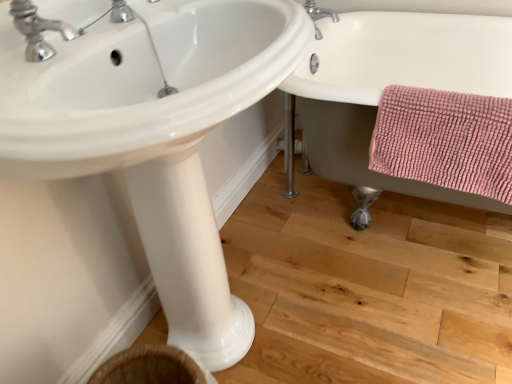
What do you see at coordinates (445, 140) in the screenshot? I see `pink chenille bath towel at lower right` at bounding box center [445, 140].

Find the location of a particular element. The width and height of the screenshot is (512, 384). pink chenille bath towel at lower right is located at coordinates (445, 140).

Image resolution: width=512 pixels, height=384 pixels. Describe the element at coordinates (154, 135) in the screenshot. I see `white glossy sink at center` at that location.

This screenshot has width=512, height=384. What do you see at coordinates (38, 30) in the screenshot? I see `chrome metallic faucet at upper left, the first tap positioned from the bottom` at bounding box center [38, 30].

The width and height of the screenshot is (512, 384). Describe the element at coordinates (390, 84) in the screenshot. I see `white ceramic bathtub at right` at that location.

Where is `silver metallic faucet at upper center, the 2th tap positioned from the bottom`? The height and width of the screenshot is (384, 512). silver metallic faucet at upper center, the 2th tap positioned from the bottom is located at coordinates (319, 15).

Consider the image. From a real-world perspective, is silver metallic faucet at upper center, the 1th tap from the back, positioned above or below pink chenille bath towel at lower right?

silver metallic faucet at upper center, the 1th tap from the back, is above pink chenille bath towel at lower right.

From the picture: From the image's perspective, is silver metallic faucet at upper center, which appears as the first tap when viewed from the top, above or below pink chenille bath towel at lower right?

Based on their image positions, silver metallic faucet at upper center, which appears as the first tap when viewed from the top, is located above pink chenille bath towel at lower right.

Measure the distance from silver metallic faucet at upper center, which is counted as the second tap, starting from the left, to pink chenille bath towel at lower right.

A distance of 28.15 inches exists between silver metallic faucet at upper center, which is counted as the second tap, starting from the left, and pink chenille bath towel at lower right.

Which is in front, silver metallic faucet at upper center, the 2th tap positioned from the bottom, or pink chenille bath towel at lower right?

pink chenille bath towel at lower right is closer to the camera.

Which is behind, point (378, 12) or point (82, 96)?

The point (378, 12) is behind.

Does white ceramic bathtub at right turn towards white glossy sink at center?

Yes, white ceramic bathtub at right faces towards white glossy sink at center.

Which object is more forward, white ceramic bathtub at right or white glossy sink at center?

white glossy sink at center is in front.

Is white ceramic bathtub at right smaller than white glossy sink at center?

Incorrect, white ceramic bathtub at right is not smaller in size than white glossy sink at center.

Does pink chenille bath towel at lower right come behind silver metallic faucet at upper center, which is counted as the second tap, starting from the left?

No.

From a real-world perspective, is pink chenille bath towel at lower right located beneath silver metallic faucet at upper center, which appears as the first tap when viewed from the top?

Yes, from a real-world perspective, pink chenille bath towel at lower right is beneath silver metallic faucet at upper center, which appears as the first tap when viewed from the top.

At what (x,y) coordinates should I click in order to perform the action: click on tap behind the pink chenille bath towel at lower right. Please return your answer as a coordinate pair (x, y). The image size is (512, 384). Looking at the image, I should click on (319, 15).

Between pink chenille bath towel at lower right and silver metallic faucet at upper center, which is the first tap from right to left, which one has more height?

With more height is pink chenille bath towel at lower right.

Which is in front, chrome metallic faucet at upper left, the first tap from the left, or white glossy pedestal at center?

chrome metallic faucet at upper left, the first tap from the left, is more forward.

How different are the orientations of chrome metallic faucet at upper left, which is the 1th tap in front-to-back order, and white glossy pedestal at center in degrees?

1.32 degrees separate the facing orientations of chrome metallic faucet at upper left, which is the 1th tap in front-to-back order, and white glossy pedestal at center.

Visually, is chrome metallic faucet at upper left, the first tap positioned from the bottom, positioned to the left or to the right of white glossy pedestal at center?

chrome metallic faucet at upper left, the first tap positioned from the bottom, is positioned on white glossy pedestal at center's left side.

Looking at this image, is silver metallic faucet at upper center, the 2th tap positioned from the bottom, bigger or smaller than white glossy sink at center?

Clearly, silver metallic faucet at upper center, the 2th tap positioned from the bottom, is smaller in size than white glossy sink at center.

Is silver metallic faucet at upper center, the 2th tap positioned from the bottom, in front of white glossy sink at center?

No, it is not.

Does silver metallic faucet at upper center, which is the first tap from right to left, have a lesser width compared to white glossy sink at center?

Indeed, silver metallic faucet at upper center, which is the first tap from right to left, has a lesser width compared to white glossy sink at center.

Between white ceramic bathtub at right and pink chenille bath towel at lower right, which one appears on the right side from the viewer's perspective?

Positioned to the right is white ceramic bathtub at right.

How much distance is there between white ceramic bathtub at right and pink chenille bath towel at lower right?

white ceramic bathtub at right and pink chenille bath towel at lower right are 10.56 inches apart from each other.

Is white ceramic bathtub at right directly adjacent to pink chenille bath towel at lower right?

There is a gap between white ceramic bathtub at right and pink chenille bath towel at lower right.

Image resolution: width=512 pixels, height=384 pixels. I want to click on bathtub in front of the pink chenille bath towel at lower right, so click(390, 84).

Does chrome metallic faucet at upper left, which is the 1th tap in front-to-back order, touch white glossy sink at center?

No, chrome metallic faucet at upper left, which is the 1th tap in front-to-back order, is not making contact with white glossy sink at center.

What's the angular difference between chrome metallic faucet at upper left, the first tap from the left, and white glossy sink at center's facing directions?

They differ by 1.91 degrees in their facing directions.

At what (x,y) coordinates should I click in order to perform the action: click on sink that appears below the chrome metallic faucet at upper left, the first tap positioned from the bottom (from a real-world perspective). Please return your answer as a coordinate pair (x, y). This screenshot has height=384, width=512. Looking at the image, I should click on (154, 135).

From the image's perspective, is chrome metallic faucet at upper left, the first tap from the left, located above or below white glossy sink at center?

chrome metallic faucet at upper left, the first tap from the left, is above white glossy sink at center.

This screenshot has width=512, height=384. What are the coordinates of `the 1st tap positioned above the pink chenille bath towel at lower right (from a real-world perspective)` in the screenshot? It's located at (319, 15).

The height and width of the screenshot is (384, 512). I want to click on bathtub above the white glossy sink at center (from the image's perspective), so pos(390,84).

From the image, which object appears to be nearer to white glossy sink at center, silver metallic faucet at upper center, placed as the 2th tap when sorted from front to back, or chrome metallic faucet at upper left, which is the 1th tap in front-to-back order?

chrome metallic faucet at upper left, which is the 1th tap in front-to-back order, is closer to white glossy sink at center.

Looking at the image, which one is located further to silver metallic faucet at upper center, which is counted as the second tap, starting from the left, chrome metallic faucet at upper left, which is the 1th tap in front-to-back order, or white glossy sink at center?

Based on the image, chrome metallic faucet at upper left, which is the 1th tap in front-to-back order, appears to be further to silver metallic faucet at upper center, which is counted as the second tap, starting from the left.

Looking at the image, which one is located further to white glossy sink at center, white ceramic bathtub at right or white glossy pedestal at center?

white ceramic bathtub at right.

Looking at the image, which one is located closer to white glossy pedestal at center, pink chenille bath towel at lower right or white ceramic bathtub at right?

The object closer to white glossy pedestal at center is pink chenille bath towel at lower right.

When comparing their distances from silver metallic faucet at upper center, the 2th tap positioned from the bottom, does white glossy pedestal at center or white ceramic bathtub at right seem further?

white glossy pedestal at center is positioned further to the anchor silver metallic faucet at upper center, the 2th tap positioned from the bottom.

From the image, which object appears to be farther from pink chenille bath towel at lower right, white glossy pedestal at center or chrome metallic faucet at upper left, the second tap from the right?

The object further to pink chenille bath towel at lower right is chrome metallic faucet at upper left, the second tap from the right.

When comparing their distances from white glossy sink at center, does pink chenille bath towel at lower right or silver metallic faucet at upper center, the 2th tap positioned from the bottom, seem further?

silver metallic faucet at upper center, the 2th tap positioned from the bottom, lies further to white glossy sink at center than the other object.

Based on the photo, considering their positions, is white glossy sink at center positioned closer to pink chenille bath towel at lower right than white ceramic bathtub at right?

Based on the image, white ceramic bathtub at right appears to be nearer to pink chenille bath towel at lower right.

Find the location of `bath towel between white glossy pedestal at center and white ceramic bathtub at right`. bath towel between white glossy pedestal at center and white ceramic bathtub at right is located at coordinates (445, 140).

Identify the location of sink between white glossy pedestal at center and white ceramic bathtub at right from left to right. The height and width of the screenshot is (384, 512). (154, 135).

Locate an element on the screen. sink situated between chrome metallic faucet at upper left, the second tap from the top, and white ceramic bathtub at right from left to right is located at coordinates (154, 135).

Identify the location of sink between white glossy pedestal at center and pink chenille bath towel at lower right from left to right. (154, 135).